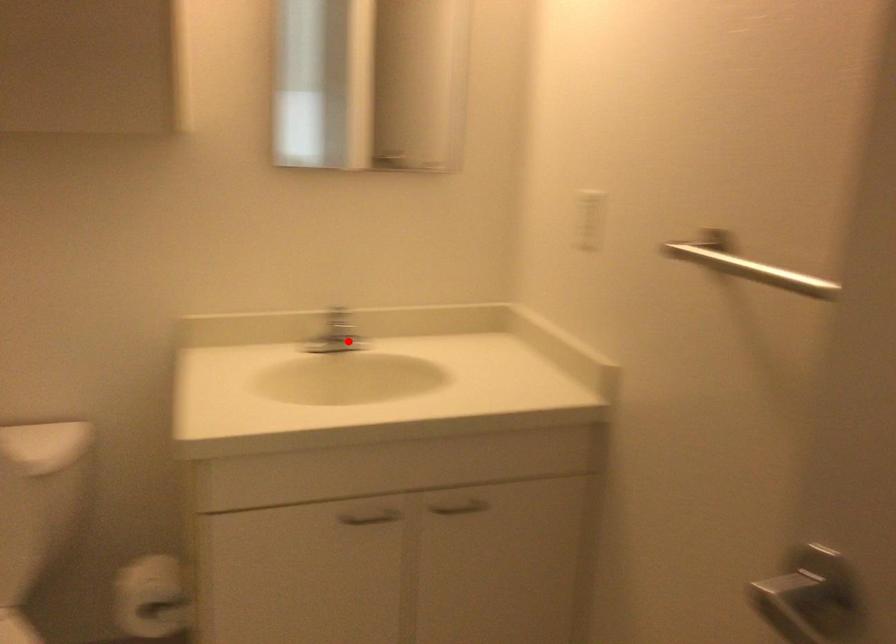
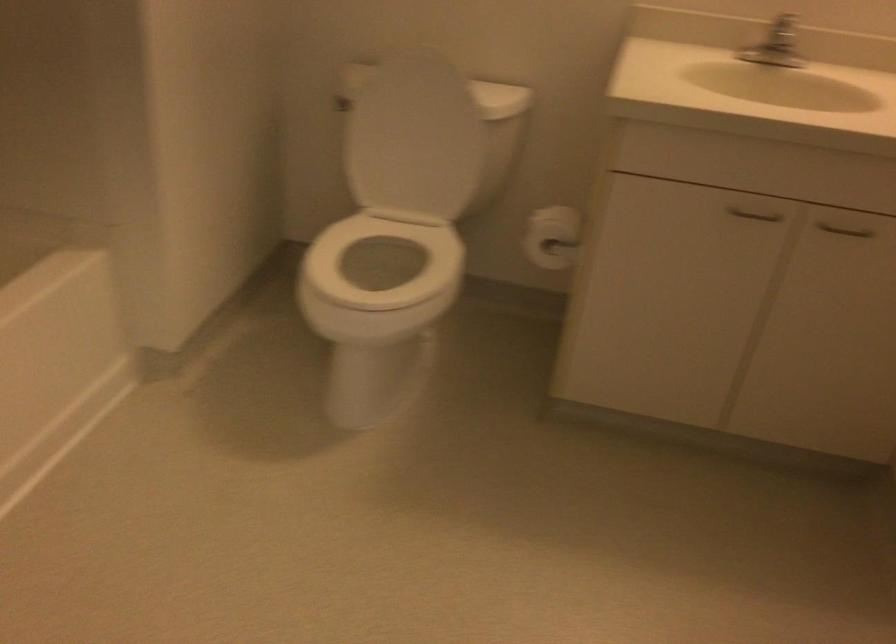
The point at the highlighted location is marked in the first image. Where is the corresponding point in the second image?

(778, 55)